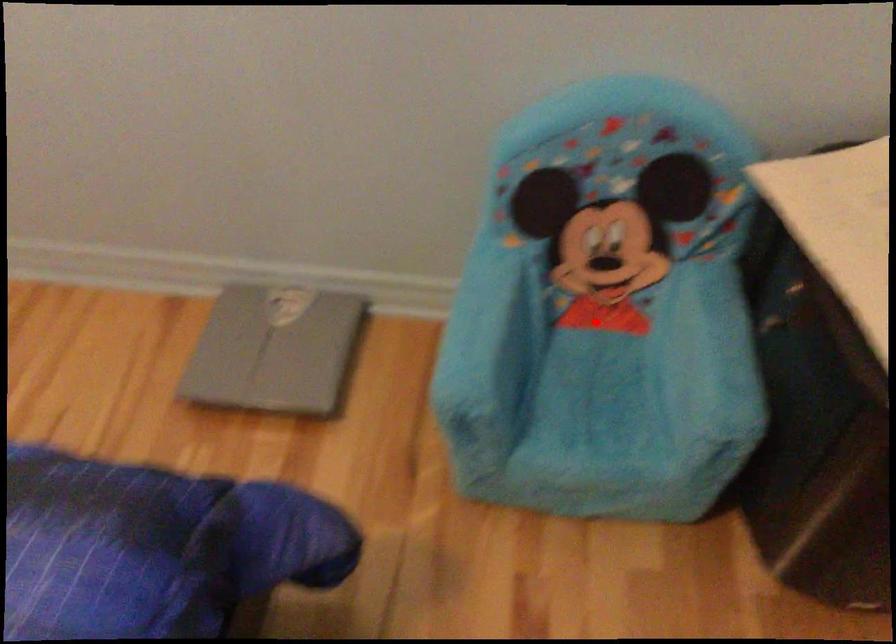
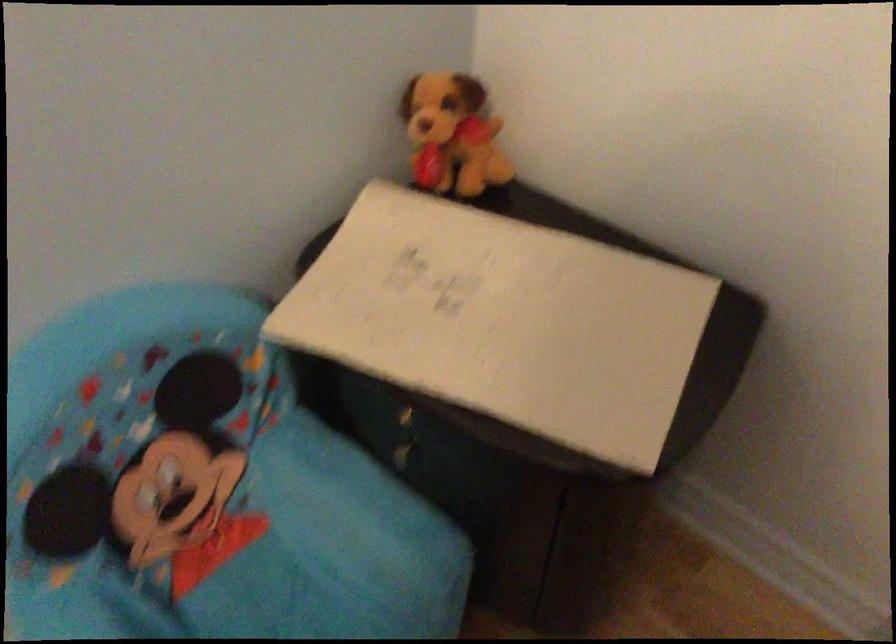
Question: I am providing you with two images of the same scene from different viewpoints. A red point is shown in image1. For the corresponding object point in image2, is it positioned nearer or farther from the camera?

Choices:
 (A) Nearer
 (B) Farther

Answer: (A)